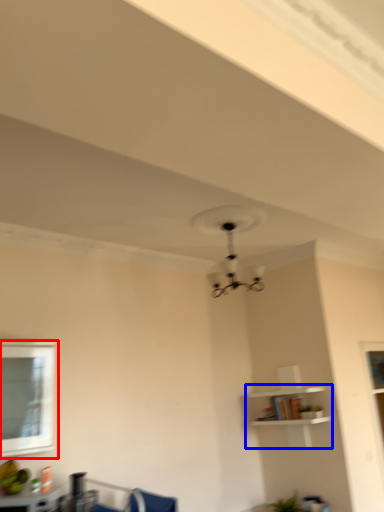
Question: Among these objects, which one is farthest to the camera, window (highlighted by a red box) or shelf (highlighted by a blue box)?

Choices:
 (A) window
 (B) shelf

Answer: (B)